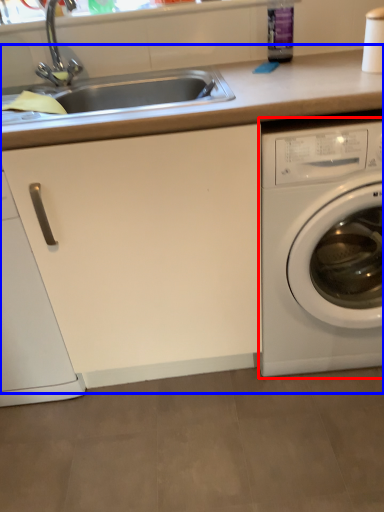
Question: Which point is further to the camera, washing machine (highlighted by a red box) or counter top (highlighted by a blue box)?

Choices:
 (A) washing machine
 (B) counter top

Answer: (A)